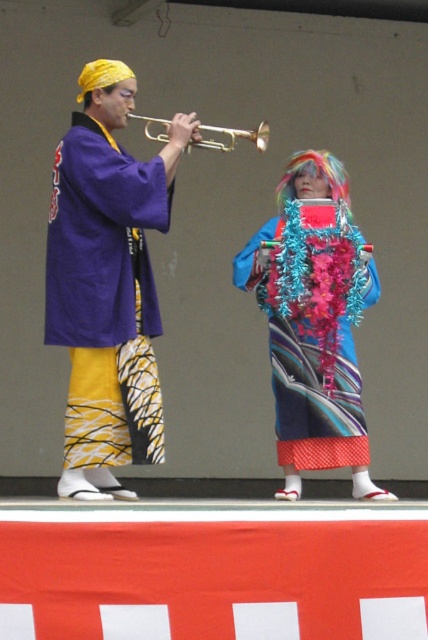
Question: Can you confirm if purple silk kimono at left is bigger than brass trumpet at center?

Choices:
 (A) no
 (B) yes

Answer: (B)

Question: Does shiny blue kimono at center appear on the right side of brass trumpet at center?

Choices:
 (A) no
 (B) yes

Answer: (B)

Question: Which object appears closest to the camera in this image?

Choices:
 (A) brass trumpet at center
 (B) purple silk kimono at left

Answer: (B)

Question: Which point is closer to the camera taking this photo?

Choices:
 (A) (165, 132)
 (B) (58, 179)

Answer: (B)

Question: Is shiny blue kimono at center to the right of brass trumpet at center from the viewer's perspective?

Choices:
 (A) no
 (B) yes

Answer: (B)

Question: Which object appears closest to the camera in this image?

Choices:
 (A) purple silk kimono at left
 (B) brass trumpet at center

Answer: (A)